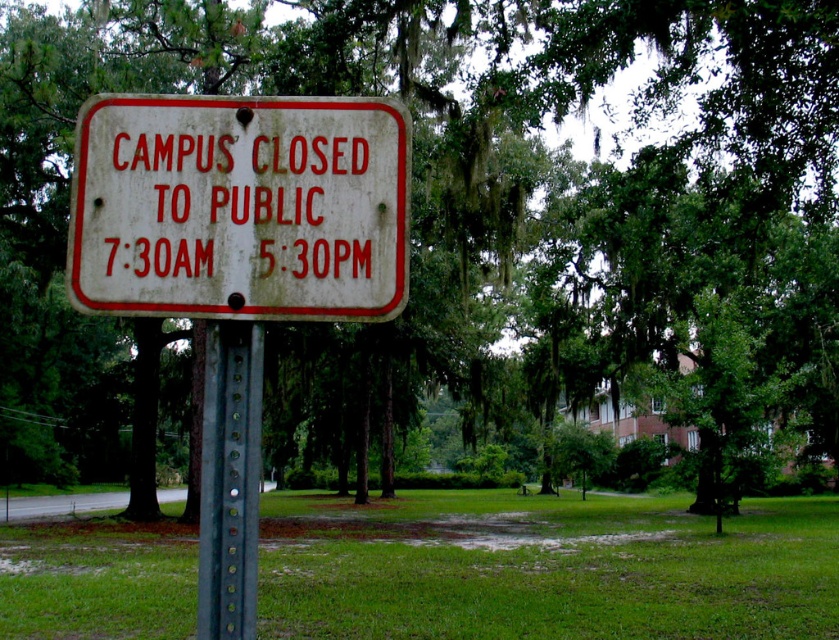
Who is shorter, white weathered sign at center or green metallic pole at center?

white weathered sign at center is shorter.

Does white weathered sign at center come behind green metallic pole at center?

Yes, it is.

Does point (241, 128) come in front of point (222, 497)?

That is False.

Where is `white weathered sign at center`? This screenshot has height=640, width=839. white weathered sign at center is located at coordinates (240, 208).